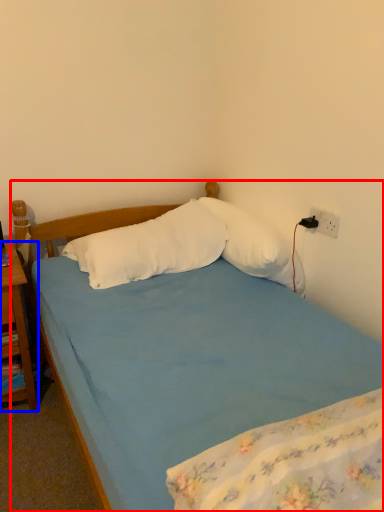
Question: Which object appears farthest to the camera in this image, bed (highlighted by a red box) or nightstand (highlighted by a blue box)?

Choices:
 (A) bed
 (B) nightstand

Answer: (B)